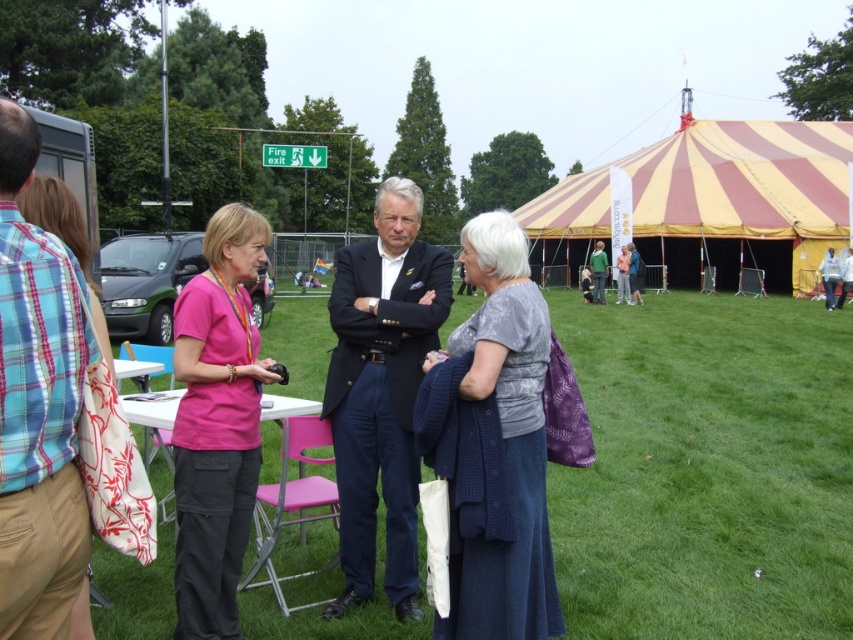
Question: From the image, what is the correct spatial relationship of yellow striped canvas tent at upper right in relation to gray textured dress at center?

Choices:
 (A) right
 (B) left

Answer: (A)

Question: Does plaid cotton shirt at left appear on the right side of navy blue suit at center?

Choices:
 (A) no
 (B) yes

Answer: (A)

Question: Estimate the real-world distances between objects in this image. Which object is farther from the navy blue suit at center?

Choices:
 (A) green grass at center
 (B) pink fabric shirt at center
 (C) gray textured dress at center
 (D) yellow striped canvas tent at upper right

Answer: (D)

Question: Can you confirm if plaid cotton shirt at left is thinner than green fabric jacket at center?

Choices:
 (A) no
 (B) yes

Answer: (B)

Question: Which point is closer to the camera?

Choices:
 (A) yellow striped canvas tent at upper right
 (B) navy blue suit at center
 (C) plaid cotton shirt at left

Answer: (C)

Question: Which point is farther to the camera?

Choices:
 (A) pink fabric shirt at center
 (B) yellow striped canvas tent at upper right
 (C) green fabric jacket at center

Answer: (B)